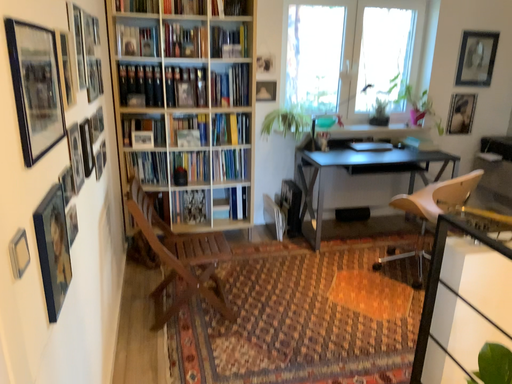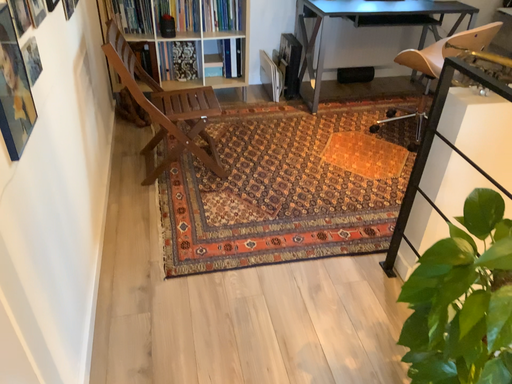
Question: How did the camera likely rotate when shooting the video?

Choices:
 (A) rotated upward
 (B) rotated downward

Answer: (B)